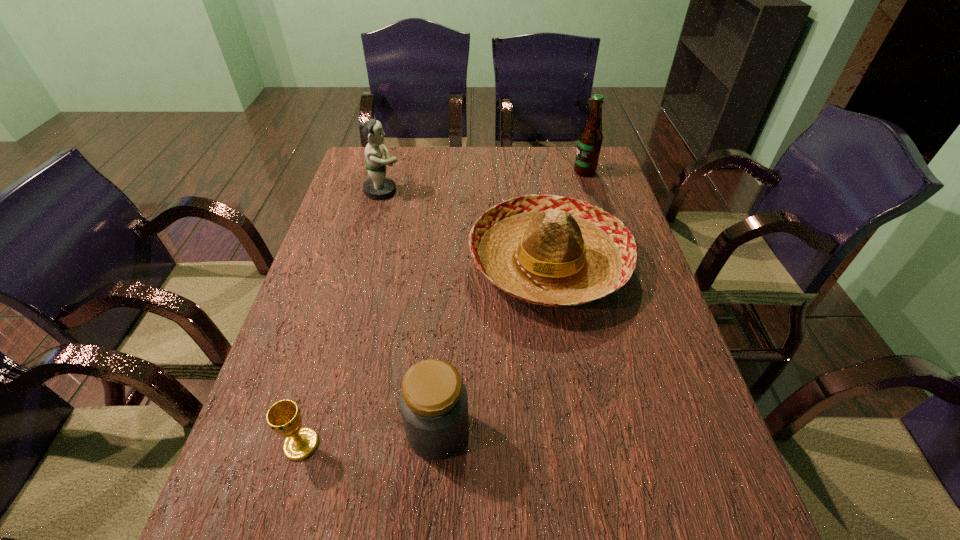
Where is `the farthest object`? The width and height of the screenshot is (960, 540). the farthest object is located at coordinates (590, 139).

The image size is (960, 540). I want to click on the fourth nearest object, so click(x=378, y=186).

Identify the location of jar. pyautogui.click(x=433, y=402).

Locate an element on the screen. This screenshot has width=960, height=540. sombrero is located at coordinates (549, 250).

The height and width of the screenshot is (540, 960). Find the location of `chalice`. chalice is located at coordinates 284,417.

In order to click on vacant space located on the label of the beer bottle in this screenshot , I will do `click(508, 172)`.

Where is `blank space located on the label of the beer bottle`? This screenshot has height=540, width=960. blank space located on the label of the beer bottle is located at coordinates (556, 172).

I want to click on vacant area situated 0.160m on the label of the beer bottle, so click(527, 172).

What are the coordinates of `free point located 0.150m on the front-facing side of the figurine` in the screenshot? It's located at (447, 191).

I want to click on vacant point located 0.300m on the surface of the jar near the warning symbol, so click(621, 430).